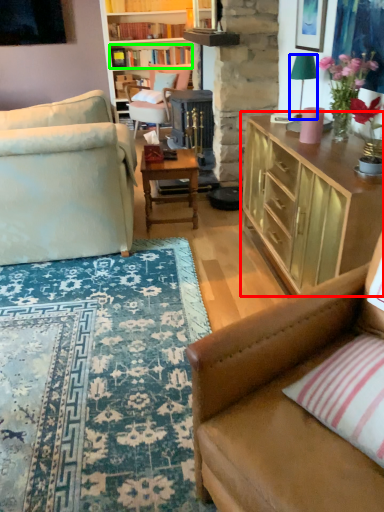
Question: Which object is positioned farthest from cabinetry (highlighted by a red box)? Select from lamp (highlighted by a blue box) and book (highlighted by a green box).

Choices:
 (A) lamp
 (B) book

Answer: (B)